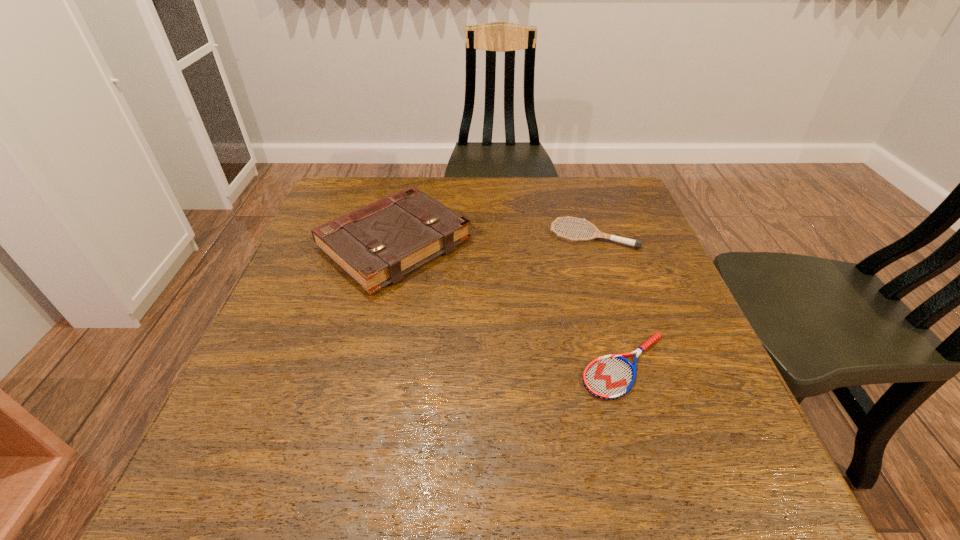
Identify the location of tennis racket positioned at the far edge. (636, 243).

At what (x,y) coordinates should I click in order to perform the action: click on object present at the left edge. Please return your answer as a coordinate pair (x, y). Image resolution: width=960 pixels, height=540 pixels. Looking at the image, I should click on (376, 245).

Image resolution: width=960 pixels, height=540 pixels. Find the location of `object positioned at the far left corner`. object positioned at the far left corner is located at coordinates (376, 245).

In order to click on object that is at the far right corner in this screenshot , I will do `click(636, 243)`.

In the image, there is a desktop. Where is `free space at the far edge`? This screenshot has height=540, width=960. free space at the far edge is located at coordinates (469, 197).

This screenshot has width=960, height=540. In the image, there is a desktop. Identify the location of free space at the near edge. (521, 468).

In the image, there is a desktop. Identify the location of free space at the left edge. (276, 349).

Identify the location of vacant space at the right edge. (606, 253).

Identify the location of vacant space at the far left corner of the desktop. The width and height of the screenshot is (960, 540). (338, 177).

This screenshot has width=960, height=540. Find the location of `free space at the near left corner of the desktop`. free space at the near left corner of the desktop is located at coordinates (193, 472).